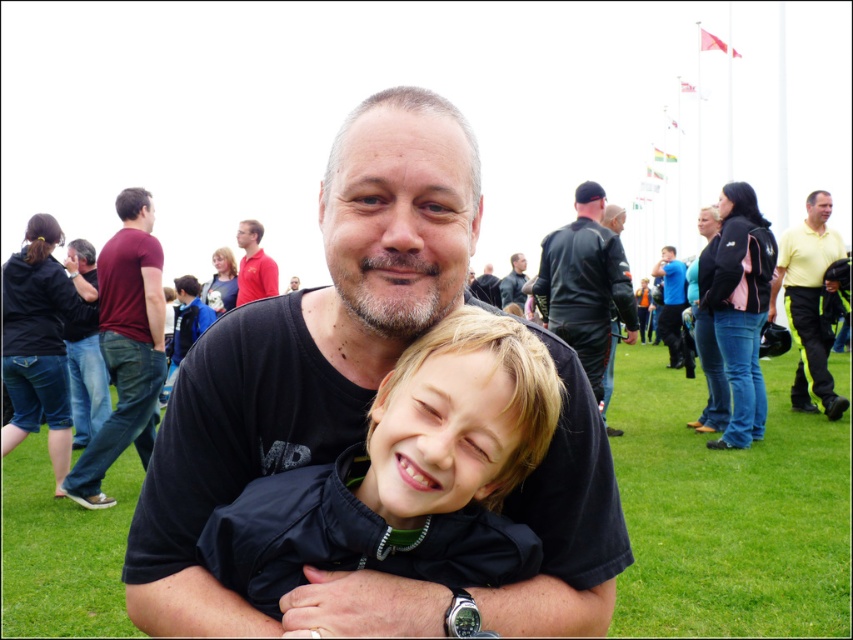
Question: Is black leather jacket at upper center to the left of matte red shirt at upper left from the viewer's perspective?

Choices:
 (A) yes
 (B) no

Answer: (B)

Question: Observing the image, what is the correct spatial positioning of dark blue jacket at center in reference to matte red shirt at upper left?

Choices:
 (A) below
 (B) above

Answer: (A)

Question: Does dark blue jacket at center have a larger size compared to black leather jacket at right?

Choices:
 (A) no
 (B) yes

Answer: (B)

Question: Which point is farther from the camera taking this photo?

Choices:
 (A) (479, 282)
 (B) (567, 397)

Answer: (A)

Question: Which point is farther from the camera taking this photo?

Choices:
 (A) (430, 369)
 (B) (663, 292)
 (C) (842, 401)

Answer: (B)

Question: Which point is farther to the camera?

Choices:
 (A) (616, 317)
 (B) (540, 288)
 (C) (497, 301)
 (D) (813, 298)

Answer: (C)